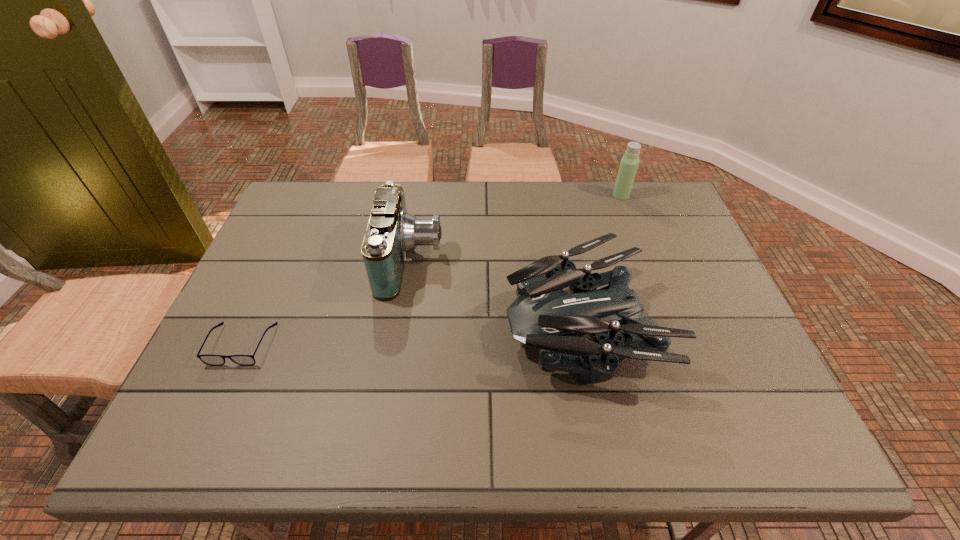
I want to click on thermos bottle, so click(x=629, y=163).

Locate an element on the screen. camcorder is located at coordinates (392, 232).

In order to click on drone in this screenshot , I will do `click(543, 316)`.

Where is `spectacles`? This screenshot has height=540, width=960. spectacles is located at coordinates (214, 360).

The image size is (960, 540). I want to click on the leftmost object, so pos(214,360).

The height and width of the screenshot is (540, 960). What are the coordinates of `vacant space located on the left of the farthest object` in the screenshot? It's located at (496, 195).

Where is `vacant space located 0.060m on the front-facing side of the third object from right to left`? The height and width of the screenshot is (540, 960). vacant space located 0.060m on the front-facing side of the third object from right to left is located at coordinates (465, 261).

At what (x,y) coordinates should I click in order to perform the action: click on vacant space located on the back of the drone. Please return your answer as a coordinate pair (x, y). Looking at the image, I should click on (560, 210).

Locate an element on the screen. The width and height of the screenshot is (960, 540). free space located 0.180m on the front-facing side of the shortest object is located at coordinates (197, 446).

Where is `thermos bottle that is at the far edge`? The height and width of the screenshot is (540, 960). thermos bottle that is at the far edge is located at coordinates (629, 163).